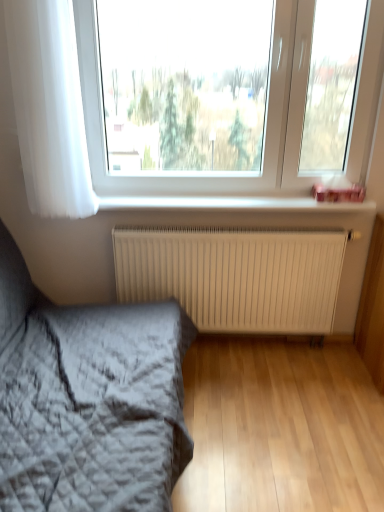
This screenshot has width=384, height=512. Identify the location of vacant space in front of white matte radiator at center. (253, 406).